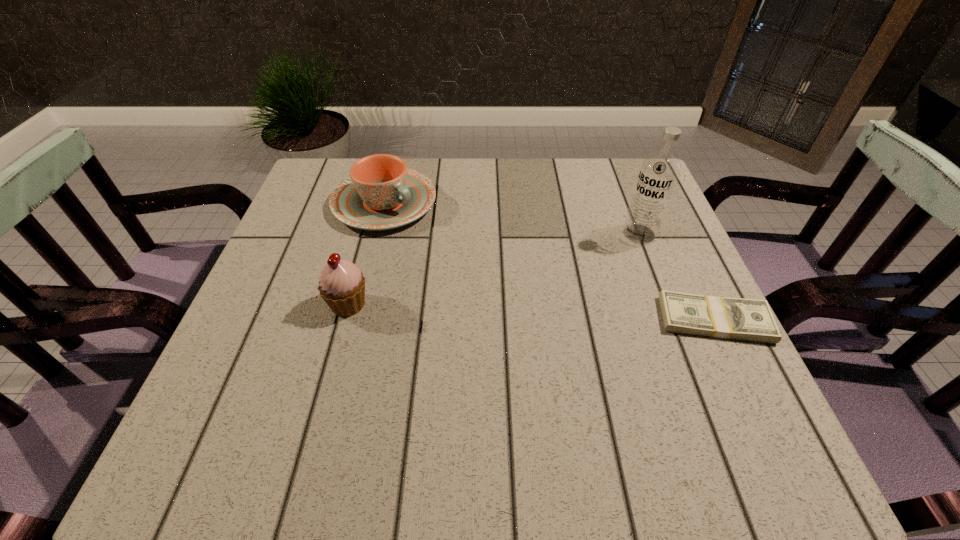
The height and width of the screenshot is (540, 960). What are the coordinates of `vacant position located on the front label of the vodka` in the screenshot? It's located at (544, 291).

You are a GUI agent. You are given a task and a screenshot of the screen. Output one action in this format:
    pyautogui.click(x=<x>, y=<y>)
    Task: Click on the free space located 0.300m on the front label of the vodka
    The height and width of the screenshot is (540, 960).
    Given the screenshot: What is the action you would take?
    pyautogui.click(x=530, y=300)

Where is `object present at the far edge`? The height and width of the screenshot is (540, 960). object present at the far edge is located at coordinates (381, 193).

What are the coordinates of `cupcake that is positioned at the left edge` in the screenshot? It's located at (342, 286).

At what (x,y) coordinates should I click in order to perform the action: click on chinaware at the left edge. Please return your answer as a coordinate pair (x, y). Image resolution: width=960 pixels, height=540 pixels. Looking at the image, I should click on (381, 193).

I want to click on dollar that is at the right edge, so click(x=719, y=317).

Locate an element on the screen. vodka that is positioned at the right edge is located at coordinates (659, 172).

The width and height of the screenshot is (960, 540). Find the location of `object that is at the far left corner`. object that is at the far left corner is located at coordinates (381, 193).

I want to click on vacant area at the far edge of the desktop, so tap(496, 200).

In the image, there is a desktop. Find the location of `free space at the near edge`. free space at the near edge is located at coordinates (378, 382).